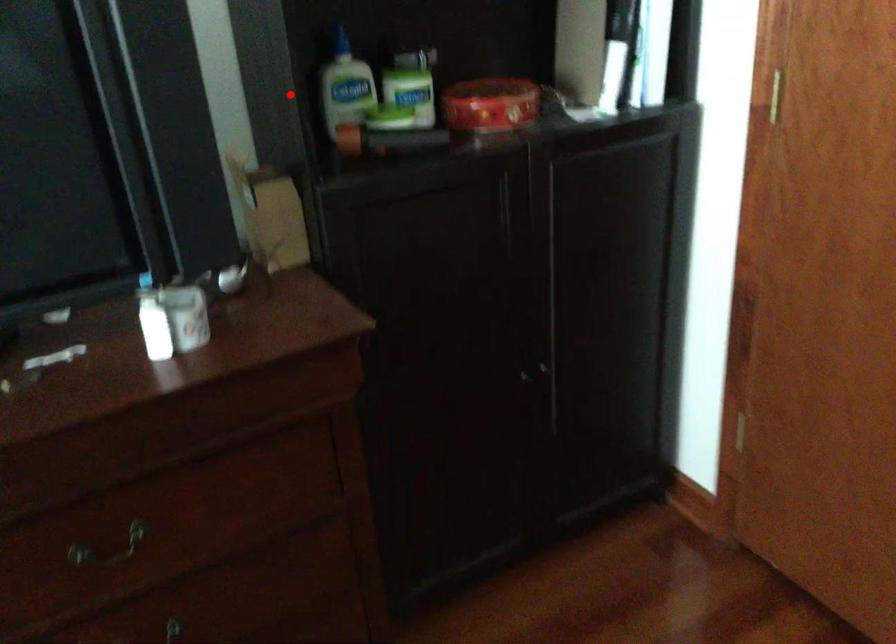
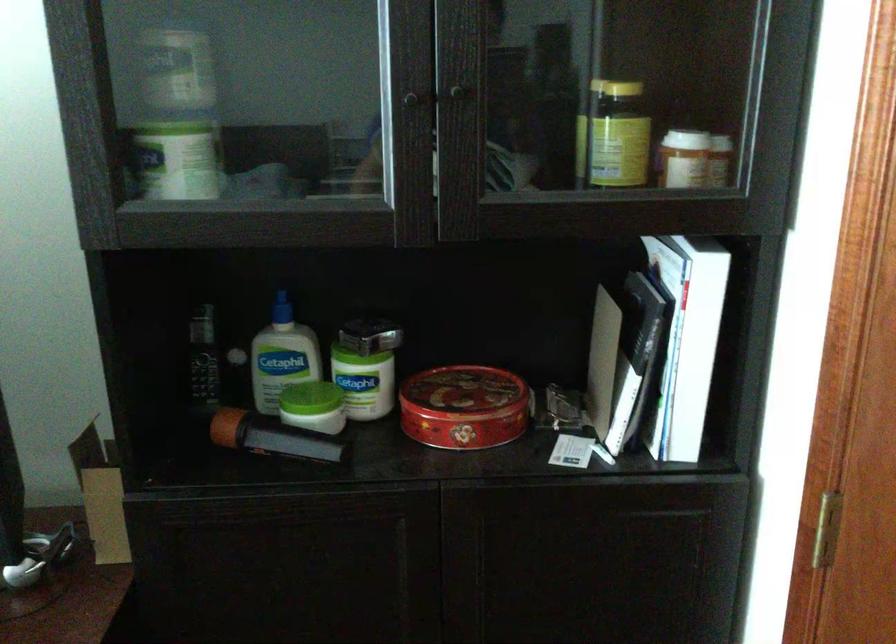
Find the pixel in the second image that matches the highlighted location in the first image.

(202, 357)